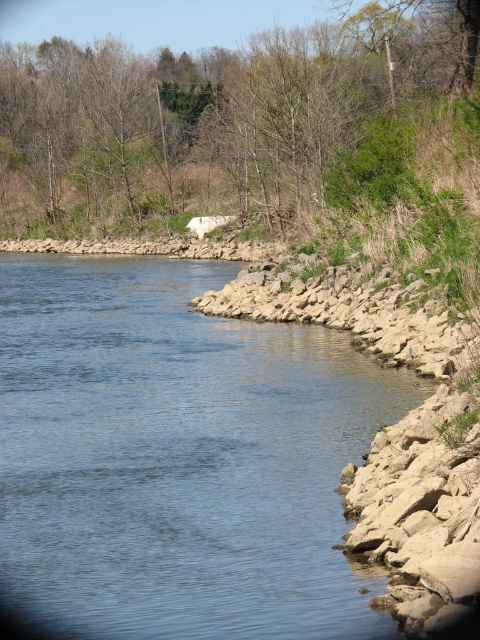
You are standing at the riverside and want to cross the blue stone river at lower right to reach the green leafy tree at upper center. Given that the river is narrower than the tree, can you safely cross the river without getting wet?

The blue stone river at lower right has a lesser width compared to green leafy tree at upper center, so the river is narrower than the tree. Therefore, you can safely cross the river without getting wet as it is narrower.

You are standing at the rocky shoreline on the right side of the riverside scene. You notice two points marked in the image. The first point is at coordinates point (257, 397) and the second is at point (62, 116). If you want to walk towards the point that is closer to you, which coordinate should you head towards?

You should head towards point (257, 397) because it is in front of point (62, 116), meaning it is closer to your current position at the rocky shoreline.